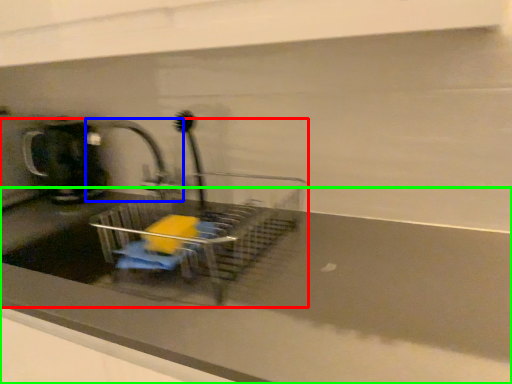
Question: Which object is positioned farthest from sink (highlighted by a red box)? Select from tap (highlighted by a blue box) and counter top (highlighted by a green box).

Choices:
 (A) tap
 (B) counter top

Answer: (A)